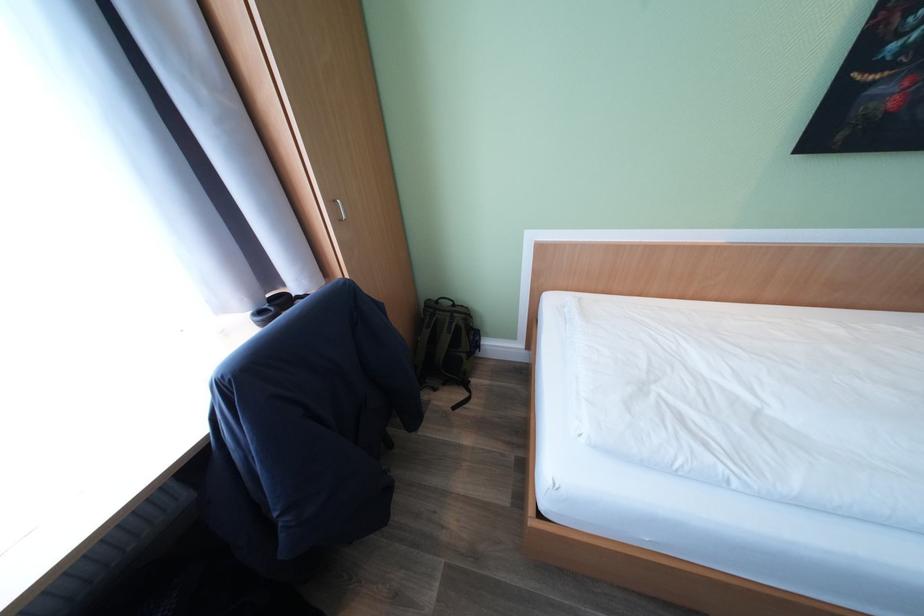
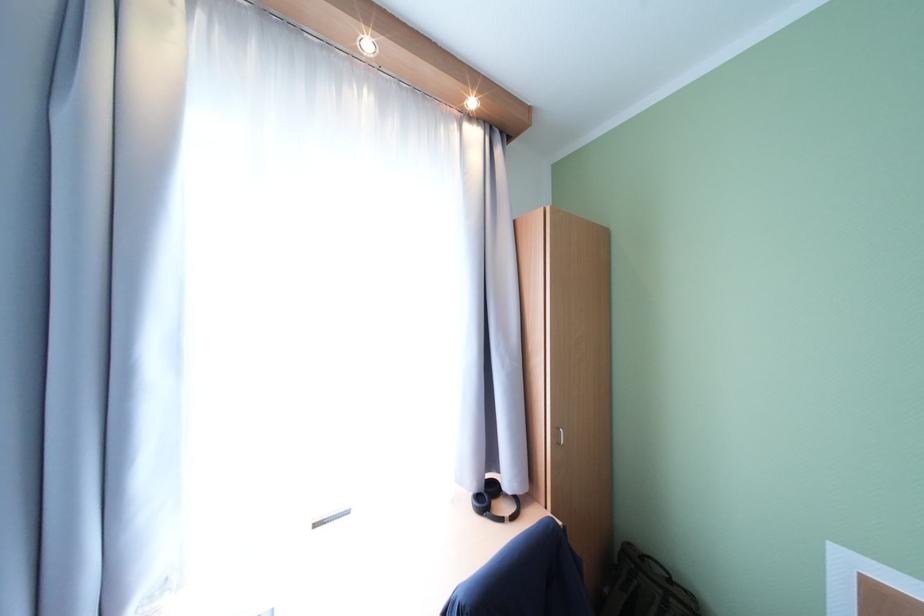
Where in the second image is the point corresponding to point (463, 315) from the first image?

(679, 602)